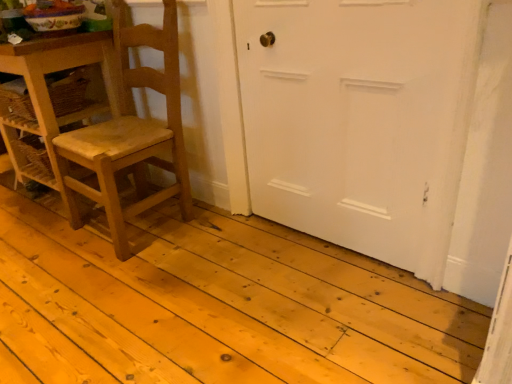
Image resolution: width=512 pixels, height=384 pixels. I want to click on vacant space situated on the left part of wooden chair at left, so click(34, 244).